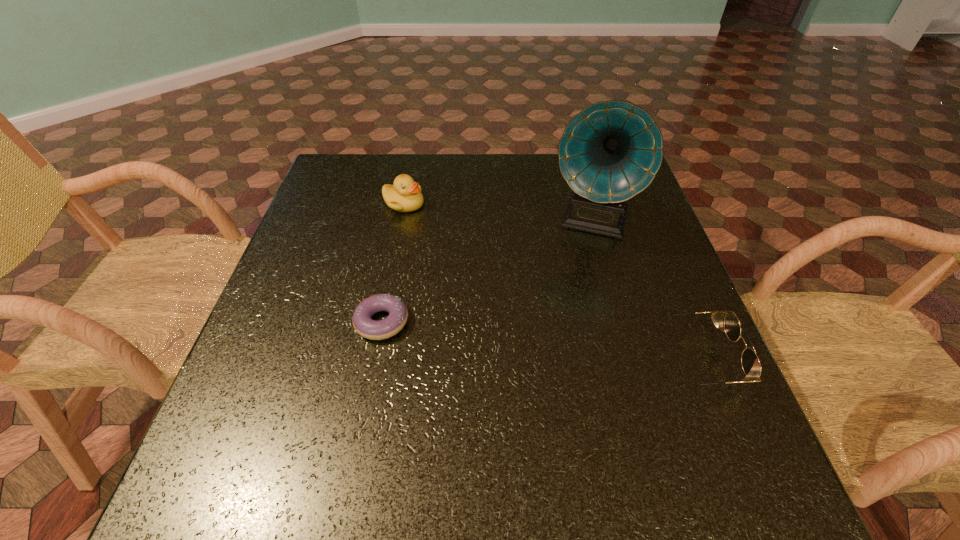
This screenshot has width=960, height=540. I want to click on free space between the phonograph_record and the shortest object, so click(486, 271).

I want to click on free space between the phonograph_record and the shortest object, so click(x=486, y=271).

You are a GUI agent. You are given a task and a screenshot of the screen. Output one action in this format:
    pyautogui.click(x=<x>, y=<y>)
    Task: Click on the free point between the duckling and the tallest object
    Image resolution: width=960 pixels, height=540 pixels.
    Given the screenshot: What is the action you would take?
    click(496, 212)

The image size is (960, 540). In order to click on empty location between the doughnut and the phonograph_record in this screenshot , I will do `click(486, 271)`.

Where is `free space between the shortest object and the tallest object`? The width and height of the screenshot is (960, 540). free space between the shortest object and the tallest object is located at coordinates (486, 271).

I want to click on object that can be found as the closest to the sunglasses, so click(x=611, y=151).

Identify which object is the nearest to the shortest object. Please provide its 2D coordinates. Your answer should be formatted as a tuple, i.e. [(x, y)], where the tuple contains the x and y coordinates of a point satisfying the conditions above.

[(405, 195)]

Find the location of `free space that satisfies the following two spatial constraints: 1. on the front side of the duckling; 2. on the front lenses of the sunglasses`. free space that satisfies the following two spatial constraints: 1. on the front side of the duckling; 2. on the front lenses of the sunglasses is located at coordinates (372, 360).

Where is `free spot that satisfies the following two spatial constraints: 1. on the front side of the tallest object; 2. on the front lenses of the sunglasses`? This screenshot has width=960, height=540. free spot that satisfies the following two spatial constraints: 1. on the front side of the tallest object; 2. on the front lenses of the sunglasses is located at coordinates (628, 360).

The image size is (960, 540). Identify the location of vacant position in the image that satisfies the following two spatial constraints: 1. on the front side of the sunglasses; 2. on the front lenses of the duckling. (372, 360).